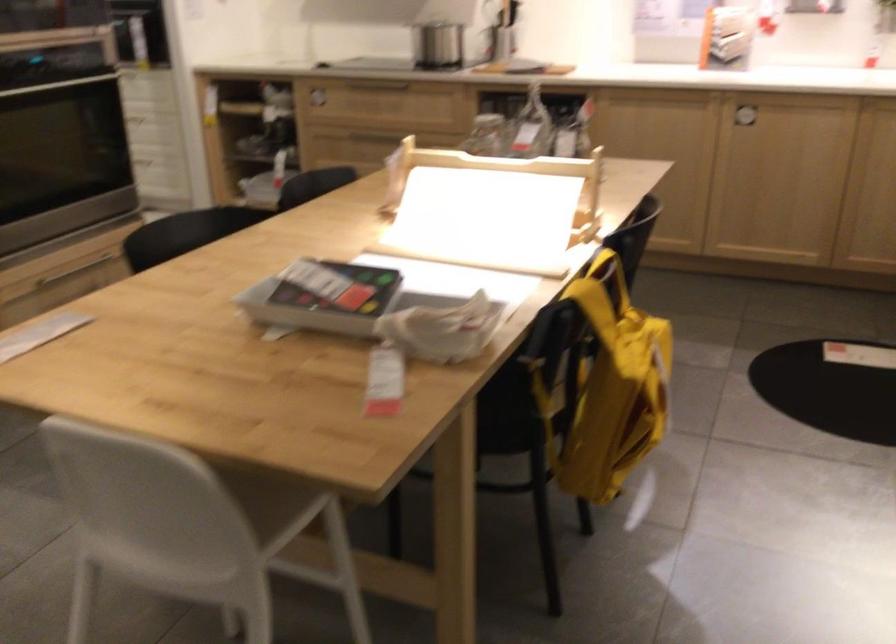
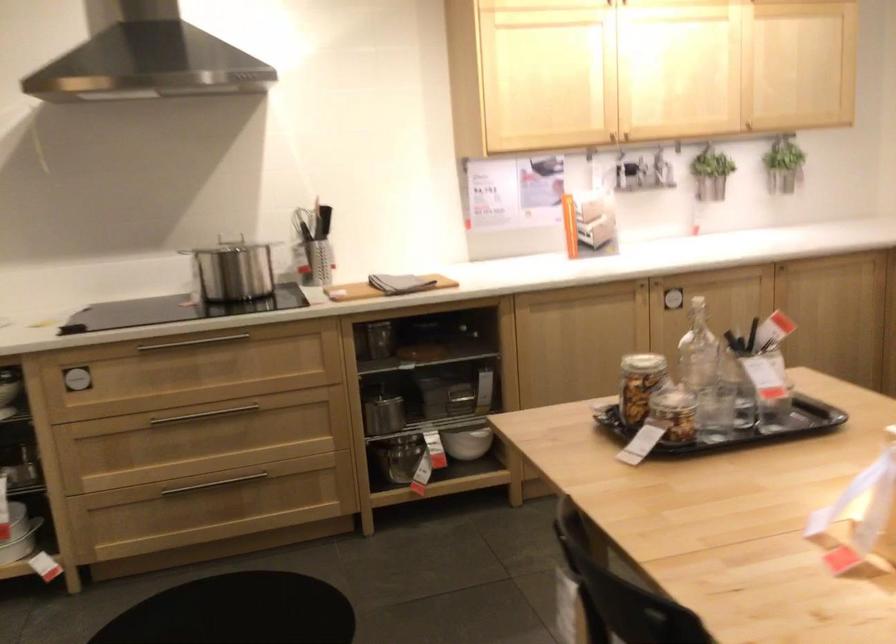
Find the pixel in the second image that matches the point at 375,80 in the first image.

(194, 343)